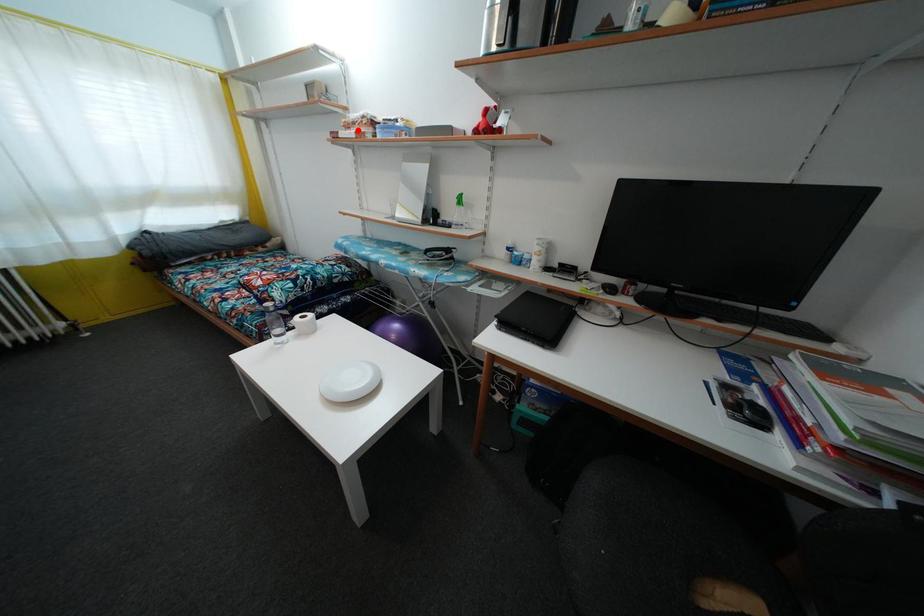
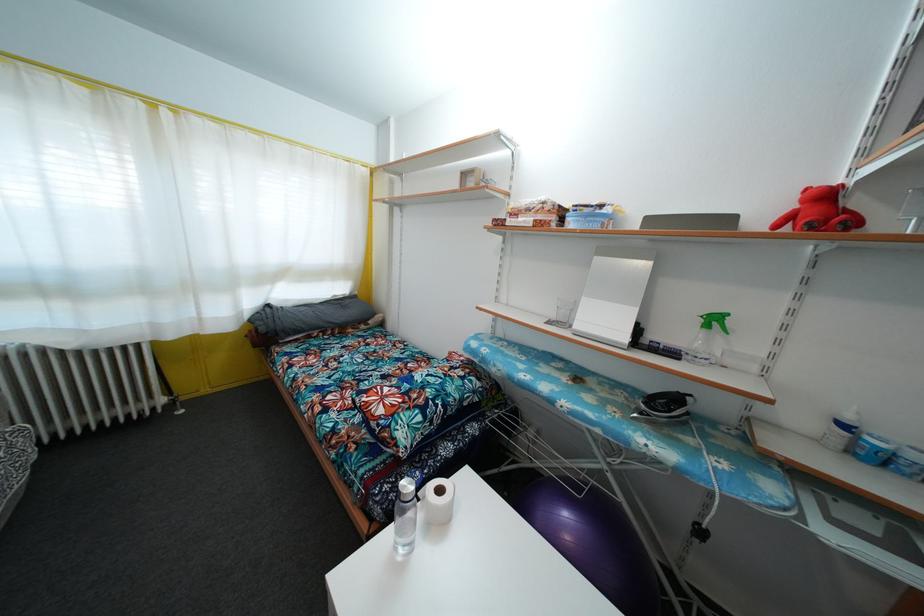
The point at the highlighted location is marked in the first image. Where is the corresponding point in the second image?

(531, 216)